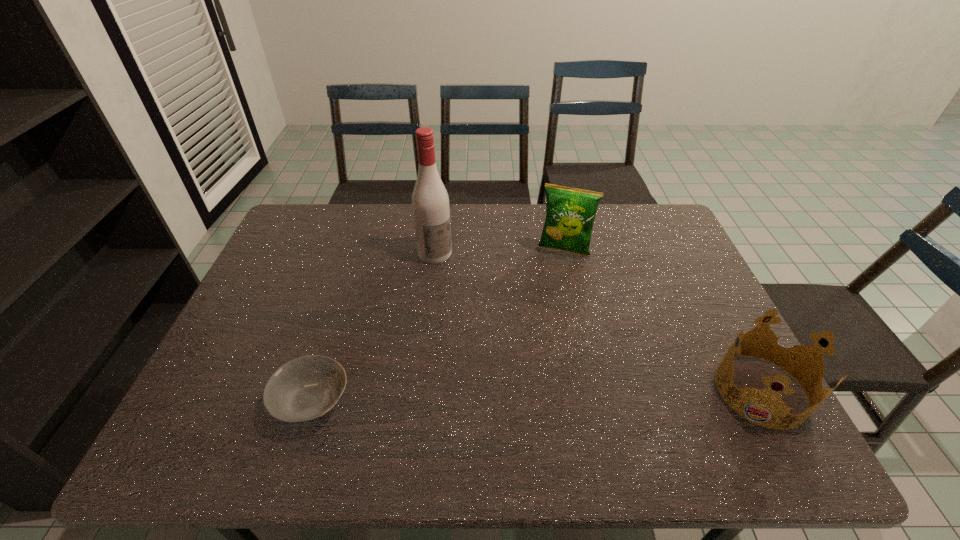
Image resolution: width=960 pixels, height=540 pixels. I want to click on bowl, so click(x=305, y=388).

Find the location of a particular element. the shortest object is located at coordinates (305, 388).

Where is `the third tallest object`? This screenshot has height=540, width=960. the third tallest object is located at coordinates (810, 353).

You are a GUI agent. You are given a task and a screenshot of the screen. Output one action in this format:
    pyautogui.click(x=<x>, y=<y>)
    Task: Click on the crown
    This screenshot has width=960, height=540.
    Given the screenshot: What is the action you would take?
    pyautogui.click(x=810, y=353)

Where is `crisp (potato chip)`? This screenshot has width=960, height=540. crisp (potato chip) is located at coordinates (570, 213).

Identify the location of the second object from right to left. (570, 213).

Image resolution: width=960 pixels, height=540 pixels. Identify the location of the second object from left to right. (430, 202).

In order to click on the tallest object in this screenshot , I will do `click(430, 202)`.

The width and height of the screenshot is (960, 540). Find the location of `free spot located 0.110m on the back of the shortest object`. free spot located 0.110m on the back of the shortest object is located at coordinates (333, 335).

Where is `vacant area situated 0.120m on the back of the third tallest object`? Image resolution: width=960 pixels, height=540 pixels. vacant area situated 0.120m on the back of the third tallest object is located at coordinates (723, 320).